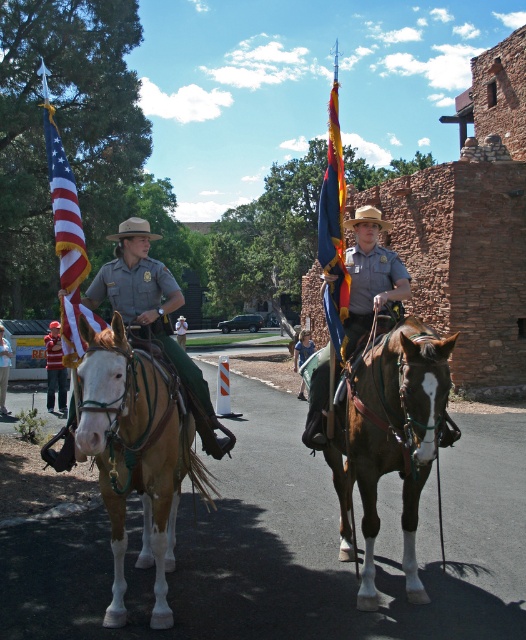
Question: Can you confirm if red knit cap at left is positioned to the right of light brown leather boots at lower center?

Choices:
 (A) yes
 (B) no

Answer: (A)

Question: Among these points, which one is farthest from the camera?

Choices:
 (A) (141, 484)
 (B) (379, 218)

Answer: (B)

Question: Which object is the farthest from the american flag at left?

Choices:
 (A) light brown leather boots at lower center
 (B) light brown straw cowboy hat at center
 (C) brushed metal helmet at upper center

Answer: (A)

Question: Can you confirm if brown glossy horse at center is positioned to the left of matte brown uniform at center?

Choices:
 (A) no
 (B) yes

Answer: (A)

Question: Which point appears farthest from the camera in this image?

Choices:
 (A) (371, 212)
 (B) (361, 268)
 (C) (180, 328)

Answer: (C)

Question: Considering the relative positions of brown glossy horse at center and shiny blue fabric flag at center in the image provided, where is brown glossy horse at center located with respect to shiny blue fabric flag at center?

Choices:
 (A) below
 (B) above

Answer: (A)